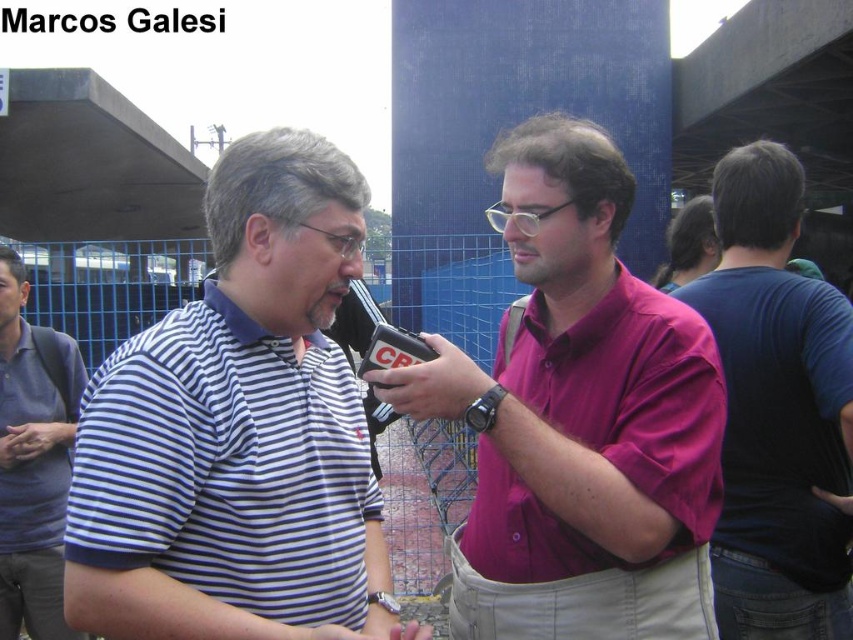
Based on the photo, between matte pink shirt at center and dark blue t-shirt at right, which one is positioned higher?

matte pink shirt at center is higher up.

Identify the location of matte pink shirt at center. The image size is (853, 640). (578, 419).

This screenshot has height=640, width=853. Find the location of `matte pink shirt at center`. matte pink shirt at center is located at coordinates (578, 419).

Which is more to the left, dark blue t-shirt at right or blue striped polo shirt at left?

blue striped polo shirt at left

Consider the image. Is dark blue t-shirt at right thinner than blue striped polo shirt at left?

Yes.

Is point (838, 365) positioned after point (0, 458)?

That is False.

The height and width of the screenshot is (640, 853). I want to click on dark blue t-shirt at right, so click(x=776, y=410).

Does blue striped shirt at center have a larger size compared to dark blue t-shirt at right?

Indeed, blue striped shirt at center has a larger size compared to dark blue t-shirt at right.

Which of these two, blue striped shirt at center or dark blue t-shirt at right, stands shorter?

Standing shorter between the two is dark blue t-shirt at right.

Identify the location of blue striped shirt at center. The height and width of the screenshot is (640, 853). (238, 432).